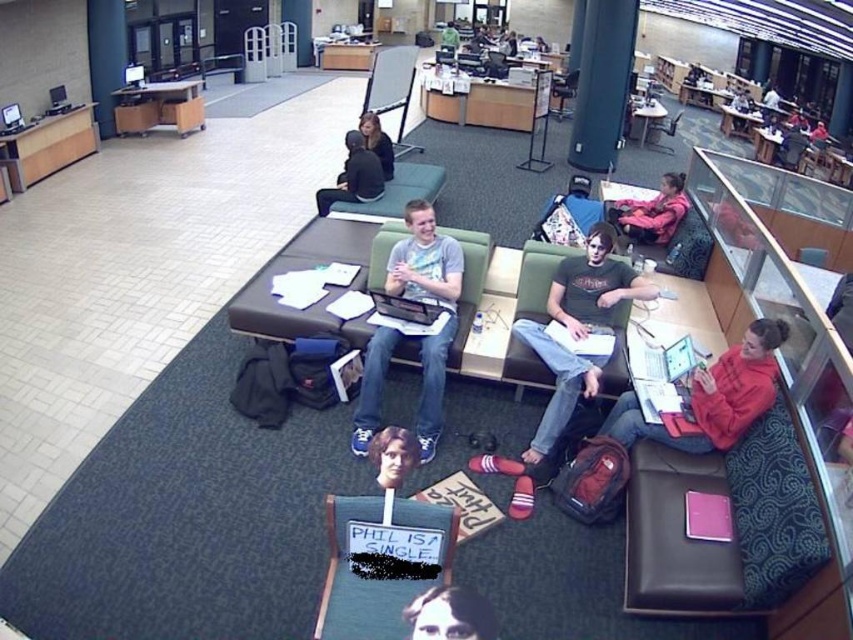
Question: Which point is closer to the camera?

Choices:
 (A) (488, 266)
 (B) (339, 182)
 (C) (442, 634)

Answer: (C)

Question: Is wooden chair at lower center wider than metallic silver chair at upper center?

Choices:
 (A) no
 (B) yes

Answer: (B)

Question: Which of the following is the closest to the observer?

Choices:
 (A) light gray t-shirt at center
 (B) smooth brown hair at lower center
 (C) green fabric chair at center
 (D) metallic silver chair at upper center

Answer: (B)

Question: Which point is farther from the camera taking this photo?

Choices:
 (A) tap(405, 624)
 (B) tap(345, 202)

Answer: (B)

Question: Does smooth brown hair at lower center have a larger size compared to dark gray sweater at center?

Choices:
 (A) yes
 (B) no

Answer: (B)

Question: Is light gray t-shirt at center below green fabric couch at center?

Choices:
 (A) no
 (B) yes

Answer: (B)